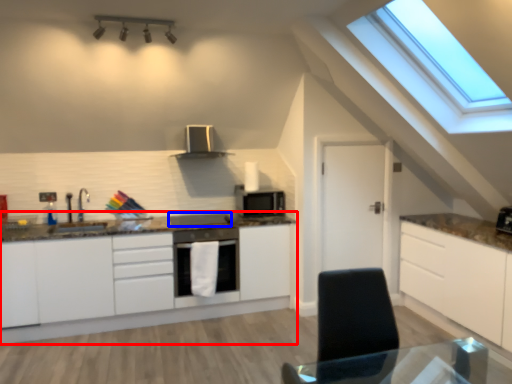
Question: Which of the following is the farthest to the observer, cabinetry (highlighted by a red box) or appliance (highlighted by a blue box)?

Choices:
 (A) cabinetry
 (B) appliance

Answer: (B)